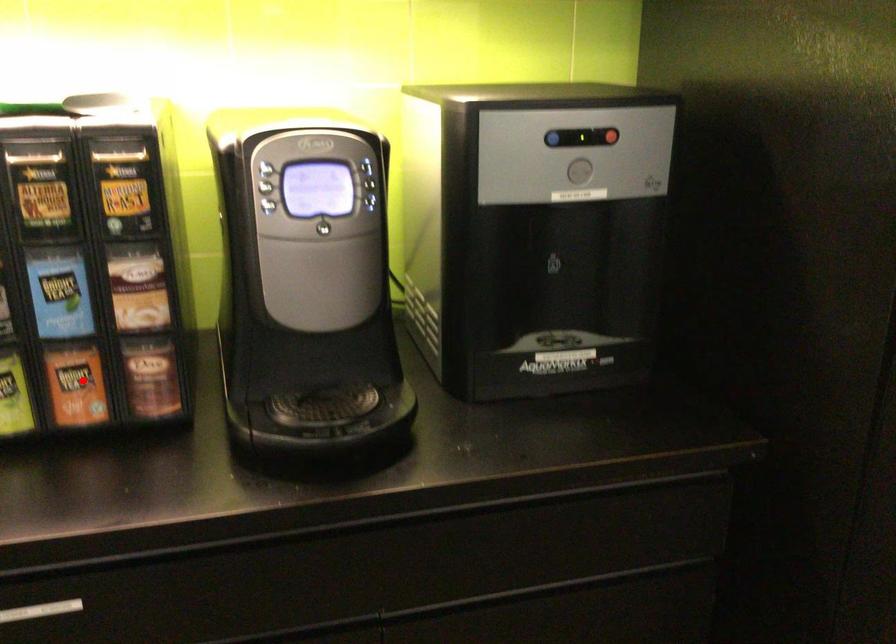
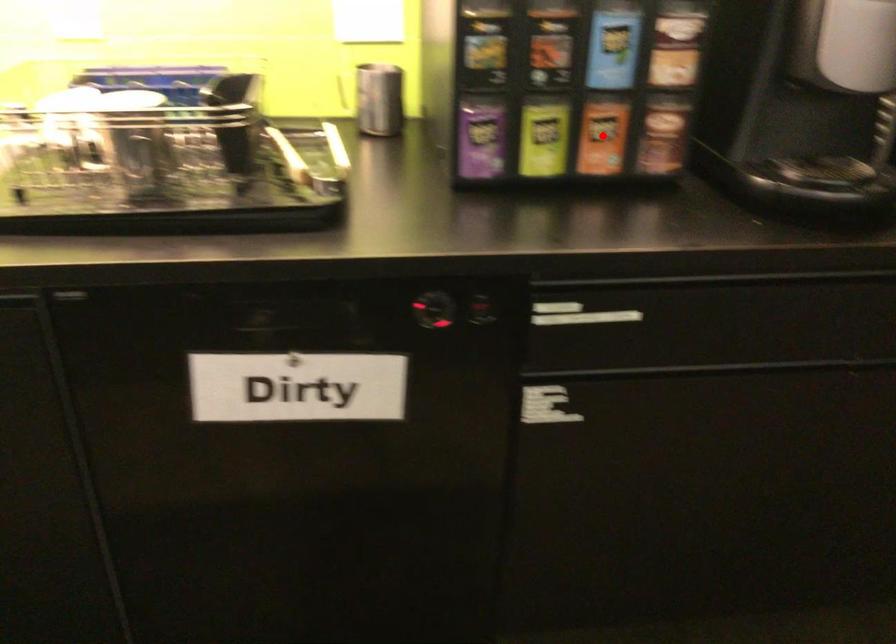
I am providing you with two images of the same scene from different viewpoints. A red point is marked on the first image and another point is marked on the second image. Do the highlighted points in image1 and image2 indicate the same real-world spot?

Yes